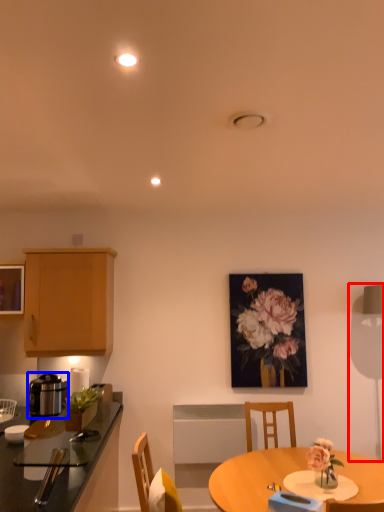
Question: Which point is closer to the camera, table lamp (highlighted by a red box) or kitchen appliance (highlighted by a blue box)?

Choices:
 (A) table lamp
 (B) kitchen appliance

Answer: (B)